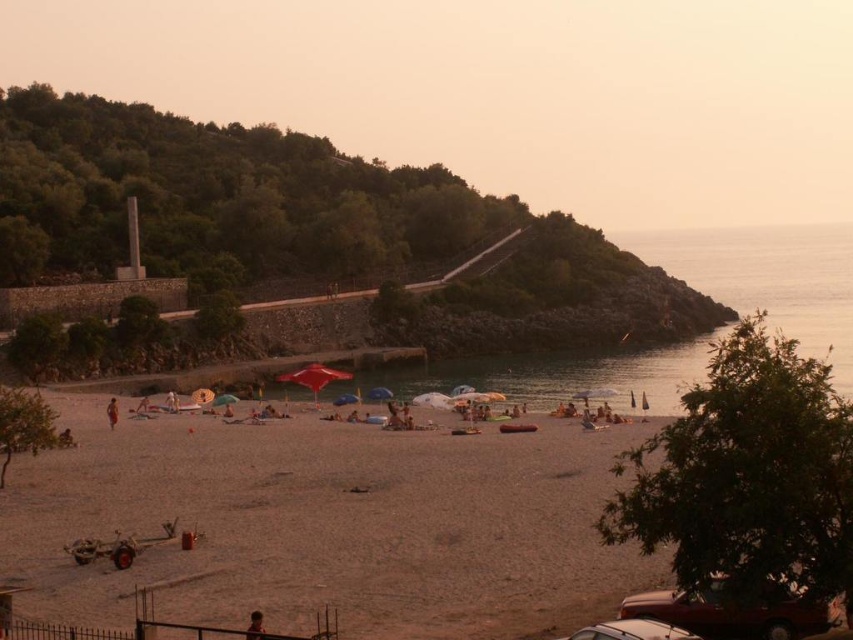
Looking at this image, you are standing on the light brown sand at center and want to reach the clear water at right. Based on the scene, which direction should you move to get to the water?

Since the light brown sand at center has a lesser height compared to the clear water at right, you should move towards the right direction to reach the water.

You are standing at the center of the beach and want to find the light brown sand at center. According to the coordinates provided, in which direction should you look to locate it?

The light brown sand at center is located at coordinates point (328,525), so you should look towards the lower right direction from the center to find it.